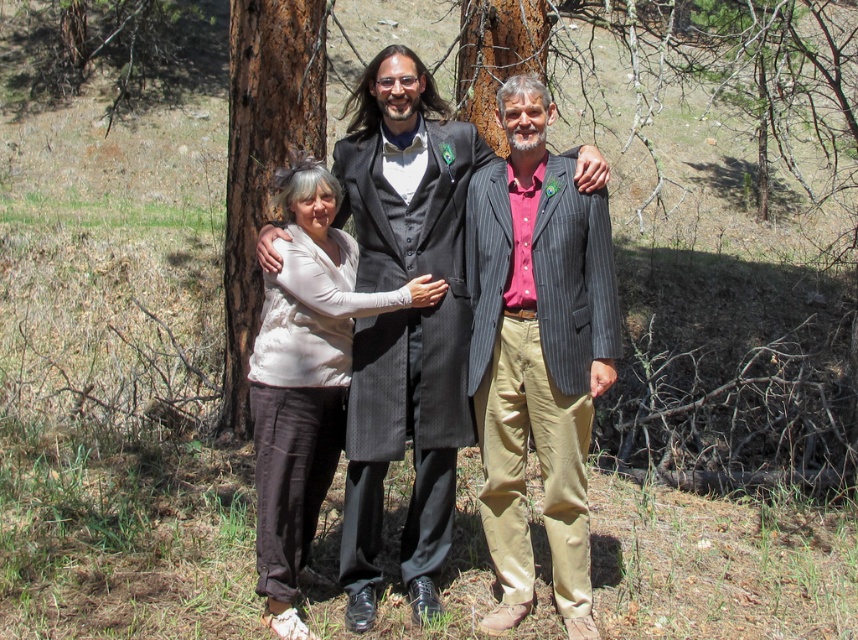
You are a photographer setting up a shoot in this forest area. You have two outfits to choose from for the main character. The first is the matte black suit at center and the second is the matte beige blouse at center. Which outfit would you recommend if you want the character to appear more slender?

The matte black suit at center is thinner than the matte beige blouse at center, so it would be the better choice to make the character appear more slender.

In the scene shown: You are a photographer trying to capture a photo of the matte beige blouse at center and the brown rough bark tree at left. Based on their widths, which object should you zoom in on to ensure both fit in the frame?

The matte beige blouse at center has a lesser width compared to the brown rough bark tree at left, so you should zoom in on the brown rough bark tree at left to ensure both fit in the frame.

You are a tailor who needs to determine which garment requires more fabric for alterations. Based on the image, which item has a smaller width between the striped wool blazer at center and the matte black suit at center?

The striped wool blazer at center has a smaller width compared to the matte black suit at center, so it would require less fabric for alterations.